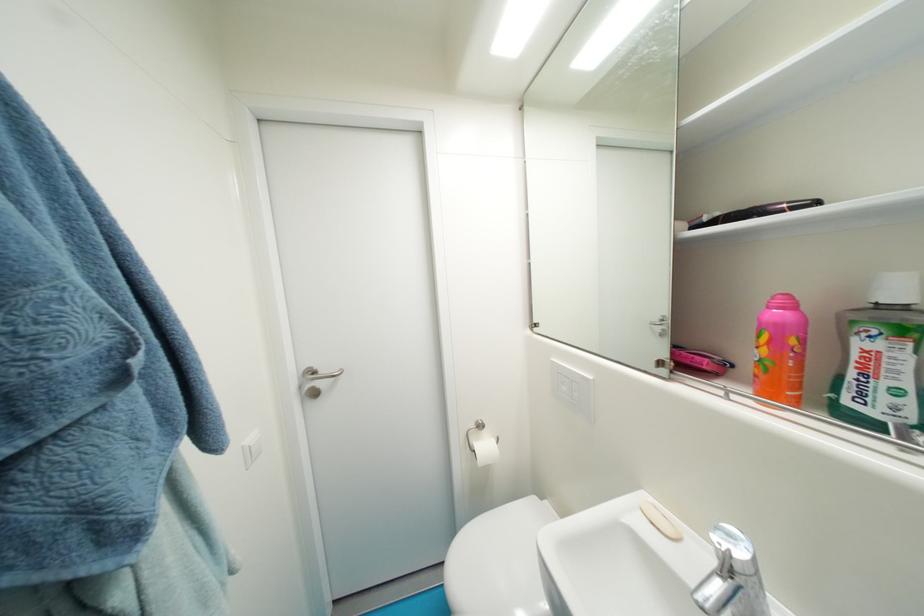
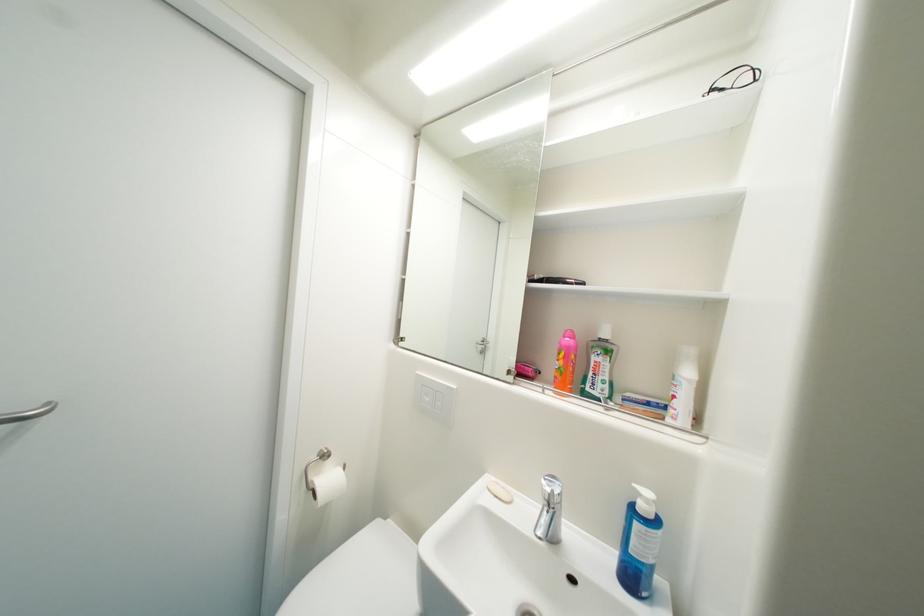
Where in the second image is the point corresponding to (x=774, y=363) from the first image?

(569, 371)